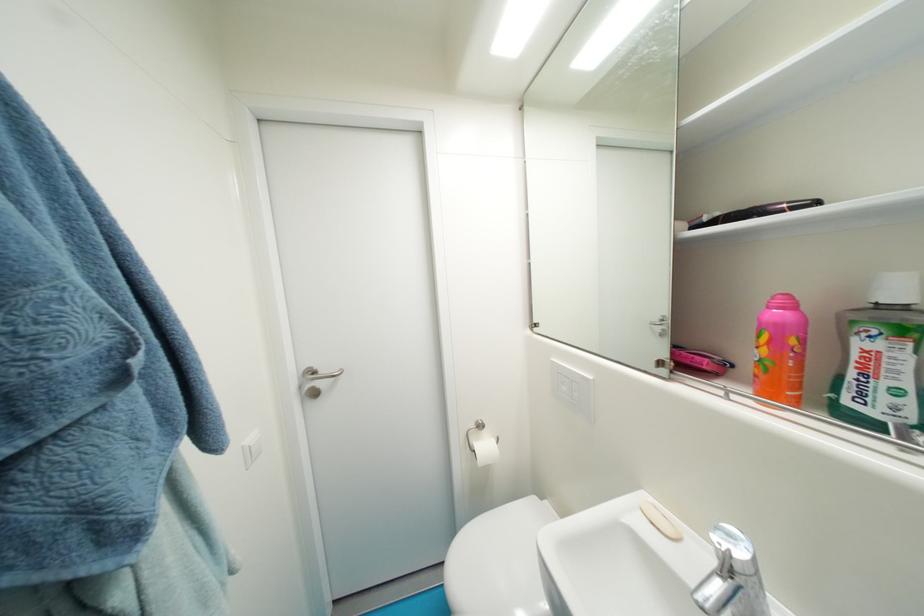
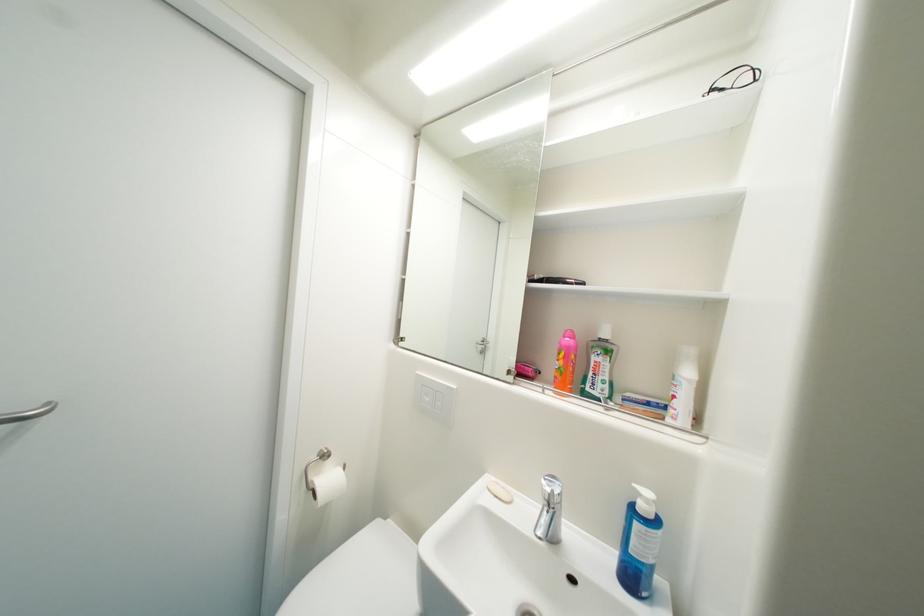
Where in the second image is the point corresponding to (x=774, y=363) from the first image?

(569, 371)